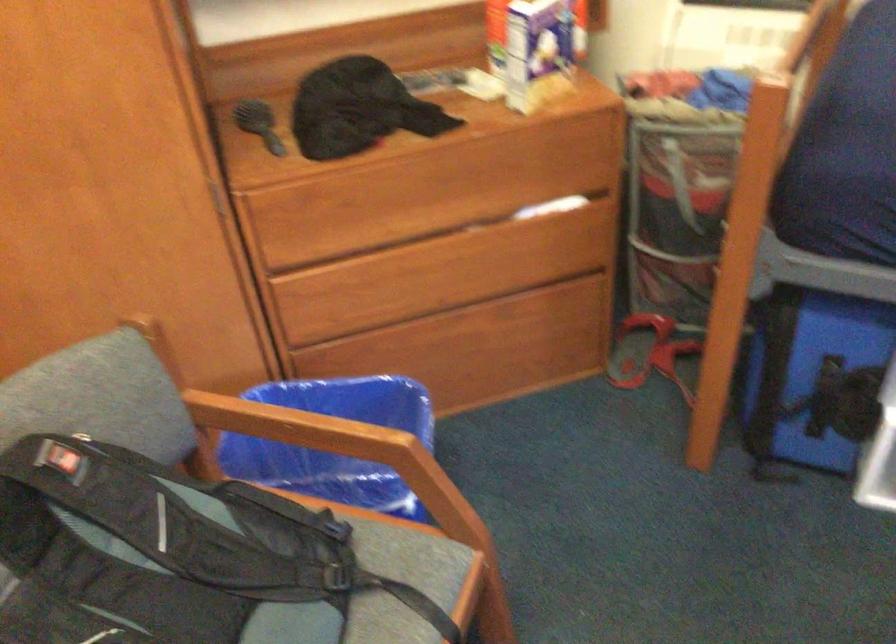
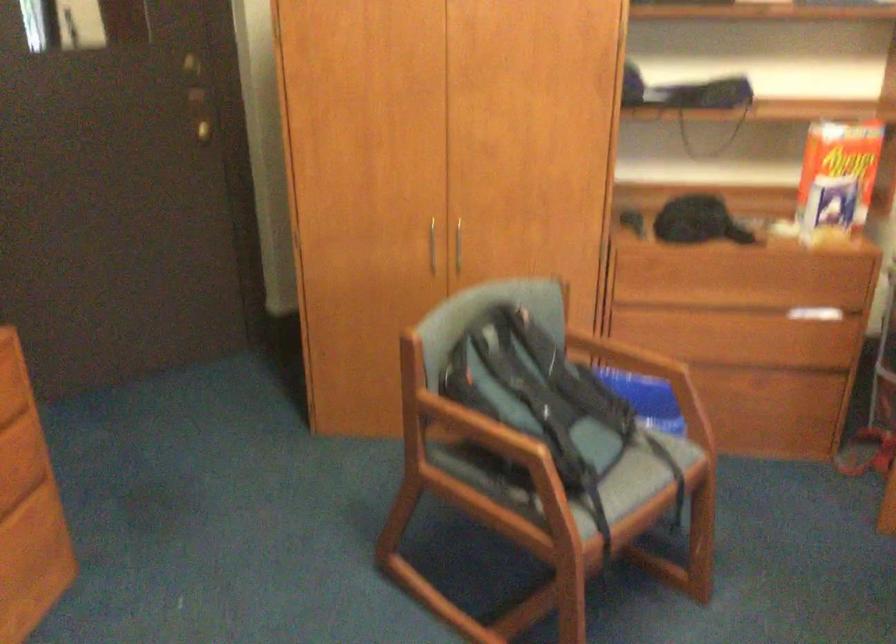
Question: The camera is either moving clockwise (left) or counter-clockwise (right) around the object. The first image is from the beginning of the video and the second image is from the end. Is the camera moving left or right when shooting the video?

Choices:
 (A) Left
 (B) Right

Answer: (B)